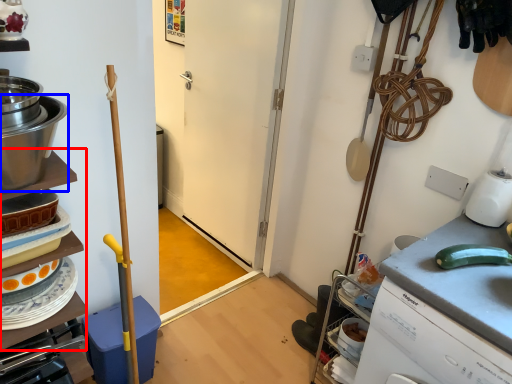
Question: Which object appears farthest to the camera in this image, shelf (highlighted by a red box) or kitchen appliance (highlighted by a blue box)?

Choices:
 (A) shelf
 (B) kitchen appliance

Answer: (A)